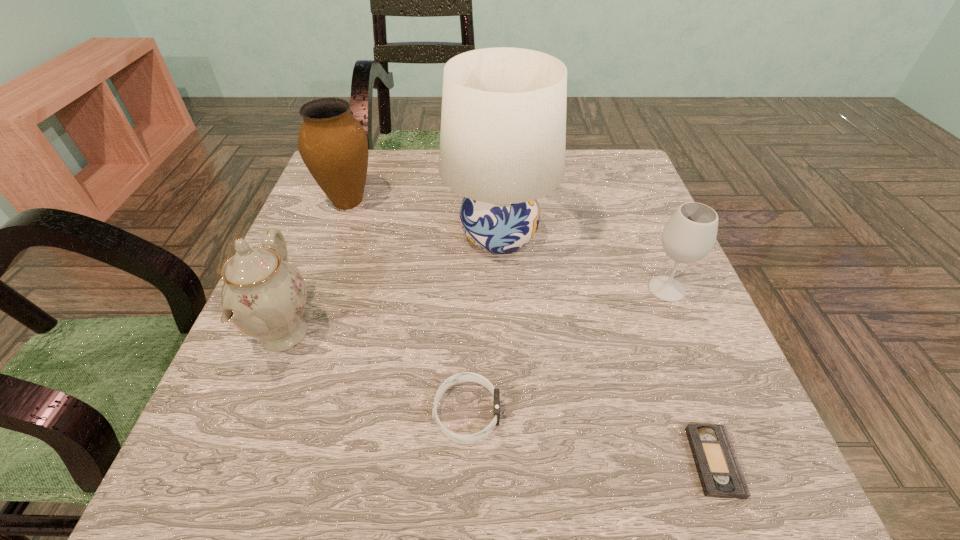
At what (x,y) coordinates should I click in order to perform the action: click on free location that satisfies the following two spatial constraints: 1. on the front side of the wineglass; 2. on the left side of the urn. Please return your answer as a coordinate pair (x, y). The width and height of the screenshot is (960, 540). Looking at the image, I should click on (316, 289).

This screenshot has height=540, width=960. I want to click on blank area in the image that satisfies the following two spatial constraints: 1. on the front-facing side of the tallest object; 2. on the back side of the videotape, so click(510, 462).

Image resolution: width=960 pixels, height=540 pixels. In order to click on vacant space that satisfies the following two spatial constraints: 1. on the spout of the videotape; 2. on the right side of the chinaware in this screenshot , I will do tap(233, 462).

At what (x,y) coordinates should I click in order to perform the action: click on blank space that satisfies the following two spatial constraints: 1. on the front-facing side of the tallest object; 2. on the right side of the shortest object. Please return your answer as a coordinate pair (x, y). Image resolution: width=960 pixels, height=540 pixels. Looking at the image, I should click on (510, 462).

Find the location of `free space that satisfies the following two spatial constraints: 1. on the front side of the wineglass; 2. on the outer surface of the wristband`. free space that satisfies the following two spatial constraints: 1. on the front side of the wineglass; 2. on the outer surface of the wristband is located at coordinates (717, 413).